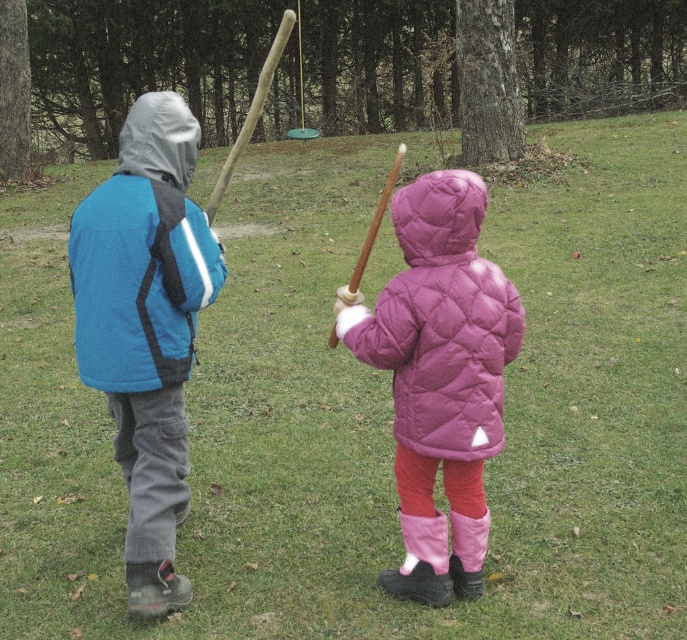
Question: Based on their relative distances, which object is nearer to the wooden bat at center?

Choices:
 (A) purple quilted jacket at center
 (B) blue fleece jacket at left

Answer: (A)

Question: Can you confirm if blue fleece jacket at left is smaller than wooden baseball bat at upper center?

Choices:
 (A) yes
 (B) no

Answer: (A)

Question: Which is farther from the blue fleece jacket at left?

Choices:
 (A) purple quilted jacket at center
 (B) wooden baseball bat at upper center

Answer: (B)

Question: Which of the following is the farthest from the observer?

Choices:
 (A) (166, 307)
 (B) (439, 344)

Answer: (A)

Question: Where is wooden baseball bat at upper center located in relation to wooden bat at center in the image?

Choices:
 (A) left
 (B) right

Answer: (A)

Question: Does purple quilted jacket at center appear on the left side of wooden baseball bat at upper center?

Choices:
 (A) no
 (B) yes

Answer: (A)